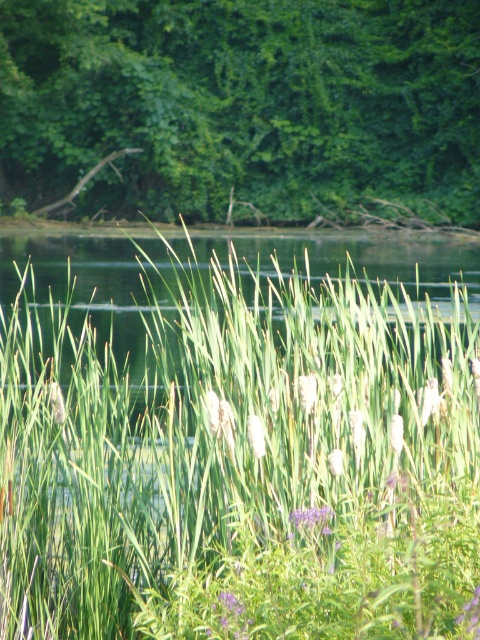
You are a gardener who needs to water the green grass at center and the green leafy tree at upper center. Your watering can holds enough water to cover 10 meters. Can you water both without refilling?

The distance between the green grass at center and the green leafy tree at upper center is 10.49 meters. Since your watering can can cover up to 10 meters, you will need to refill it to water both locations.

You are standing in the natural scene described. You want to walk from the green leafy tree at upper center to the green grass at center. In which direction should you move relative to the tree?

You should move to the right relative to the green leafy tree at upper center to reach the green grass at center.